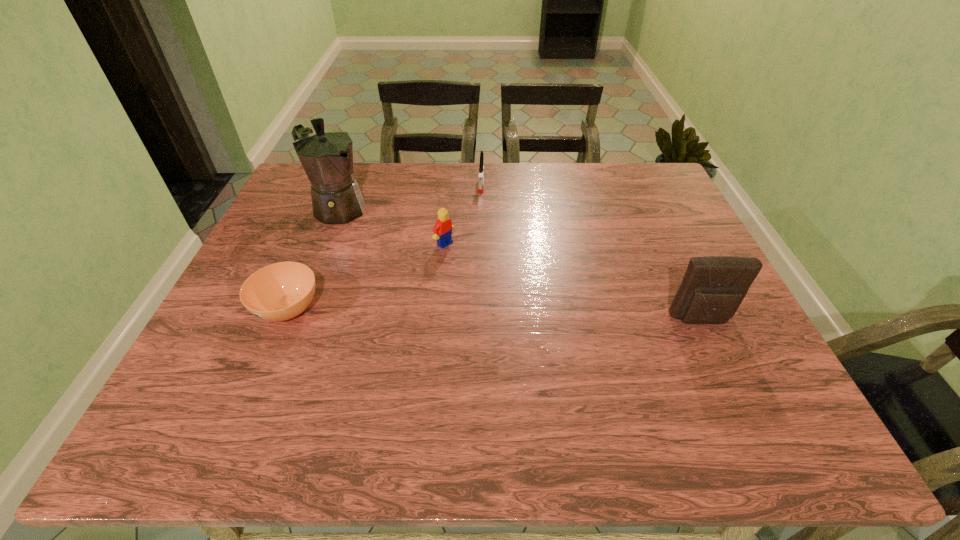
Find the location of a particular element. vacant area that lies between the stapler and the coffeepot is located at coordinates (408, 195).

At what (x,y) coordinates should I click in order to perform the action: click on free space between the fourth shortest object and the second object from right to left. Please return your answer as a coordinate pair (x, y). The width and height of the screenshot is (960, 540). Looking at the image, I should click on (591, 252).

The height and width of the screenshot is (540, 960). I want to click on blank region between the tallest object and the fourth shortest object, so click(x=518, y=264).

This screenshot has height=540, width=960. Find the location of `free space that is in between the rightmost object and the third farthest object`. free space that is in between the rightmost object and the third farthest object is located at coordinates (573, 282).

Where is `vacant area between the rightmost object and the soup bowl`? The height and width of the screenshot is (540, 960). vacant area between the rightmost object and the soup bowl is located at coordinates (494, 314).

Image resolution: width=960 pixels, height=540 pixels. I want to click on empty space that is in between the soup bowl and the pouch, so (494, 314).

At what (x,y) coordinates should I click in order to perform the action: click on free area in between the second object from right to left and the coffeepot. Please return your answer as a coordinate pair (x, y). This screenshot has width=960, height=540. Looking at the image, I should click on (408, 195).

This screenshot has width=960, height=540. What are the coordinates of `unoccupied position between the coffeepot and the third farthest object` in the screenshot? It's located at (390, 226).

At what (x,y) coordinates should I click in order to perform the action: click on free space between the tallest object and the third nearest object. Please return your answer as a coordinate pair (x, y). This screenshot has width=960, height=540. Looking at the image, I should click on (390, 226).

The image size is (960, 540). Identify the location of free spot between the fourth object from left to right and the pouch. (591, 252).